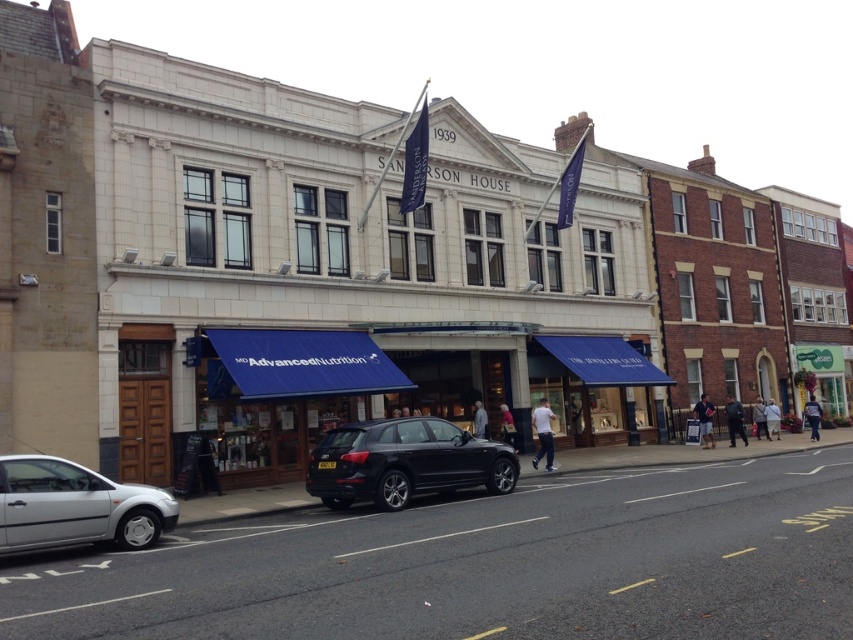
Looking at this image, you are standing on the sidewalk in front of the two awnings. You see a white cotton tshirt at center located at point (543, 433). Which awning is closer to the white cotton tshirt at center?

The white cotton tshirt at center is located at point (543, 433). Since the coordinates are given, the awning closer to this point would depend on their positions. However, based on the scene description, the blue awning with white text is on one side and the other awning is mentioned but not described. Without specific coordinate data for the awnings, it is impossible to determine which is closer.

You are a fashion designer observing a mannequin wearing both the light blue jeans at center and the white cotton shirt at center. Which clothing item is visible on top?

The light blue jeans at center is positioned over the white cotton shirt at center, so the light blue jeans at center is visible on top.

You are standing on the sidewalk in front of the building and want to take a photo of both the light blue jeans at center and the white cotton shirt at center. Which one should you focus on first to ensure both are in the frame?

You should focus on the light blue jeans at center first since it is in front of the white cotton shirt at center, ensuring both are captured in the photo.